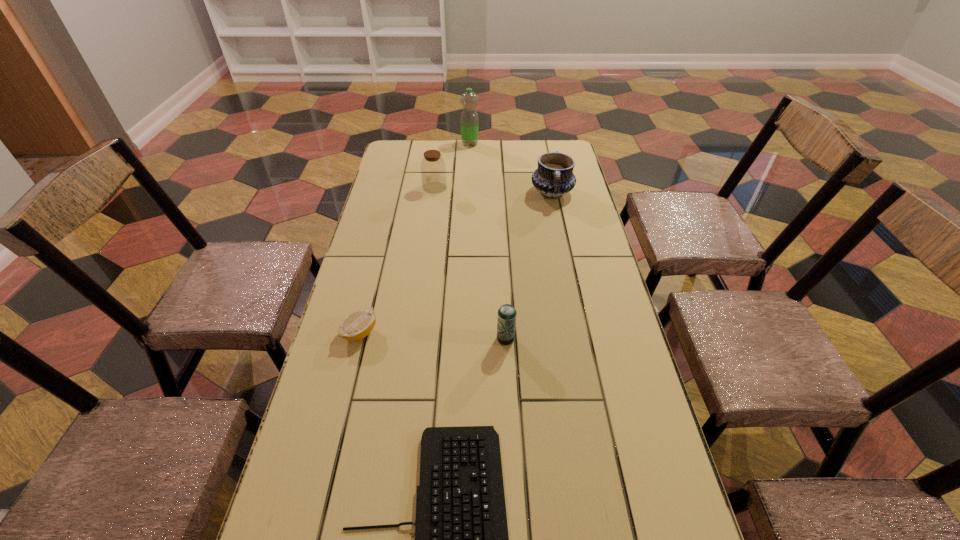
The image size is (960, 540). In order to click on water bottle in this screenshot , I will do `click(469, 117)`.

You are a GUI agent. You are given a task and a screenshot of the screen. Output one action in this format:
    pyautogui.click(x=<x>, y=<y>)
    Task: Click on the farthest object
    The width and height of the screenshot is (960, 540).
    Given the screenshot: What is the action you would take?
    pyautogui.click(x=469, y=117)

Locate an element on the screen. The height and width of the screenshot is (540, 960). jar is located at coordinates (433, 170).

Locate an element on the screen. The image size is (960, 540). the rightmost object is located at coordinates (554, 177).

The height and width of the screenshot is (540, 960). In order to click on beer can in this screenshot , I will do `click(506, 323)`.

The image size is (960, 540). In order to click on lemon in this screenshot , I will do `click(358, 324)`.

I want to click on the leftmost object, so click(x=358, y=324).

This screenshot has width=960, height=540. In order to click on free spot located 0.190m on the right of the farthest object in this screenshot , I will do `click(522, 144)`.

Where is `vacant space located 0.360m on the front of the jar`? The height and width of the screenshot is (540, 960). vacant space located 0.360m on the front of the jar is located at coordinates 425,259.

Where is `vacant space located on the left of the pottery`? This screenshot has height=540, width=960. vacant space located on the left of the pottery is located at coordinates (439, 193).